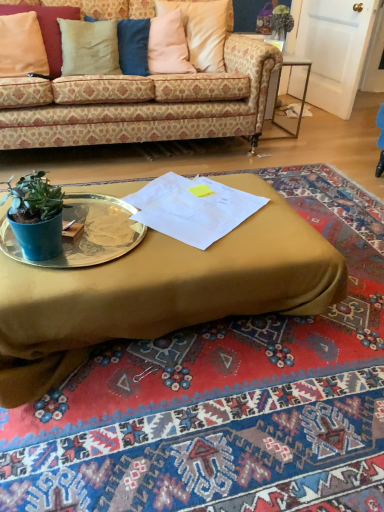
Question: Does beige fabric pillow at upper left, which is the second pillow from right to left, appear on the left side of metallic silver platter at center?

Choices:
 (A) no
 (B) yes

Answer: (B)

Question: Does beige fabric pillow at upper left, acting as the second pillow starting from the left, have a larger size compared to metallic silver platter at center?

Choices:
 (A) yes
 (B) no

Answer: (A)

Question: Could you tell me if beige fabric pillow at upper left, acting as the second pillow starting from the left, is facing metallic silver platter at center?

Choices:
 (A) yes
 (B) no

Answer: (A)

Question: Considering the relative sizes of beige fabric pillow at upper left, acting as the second pillow starting from the left, and metallic silver platter at center in the image provided, is beige fabric pillow at upper left, acting as the second pillow starting from the left, taller than metallic silver platter at center?

Choices:
 (A) yes
 (B) no

Answer: (A)

Question: Considering the relative sizes of beige fabric pillow at upper left, acting as the second pillow starting from the left, and metallic silver platter at center in the image provided, is beige fabric pillow at upper left, acting as the second pillow starting from the left, thinner than metallic silver platter at center?

Choices:
 (A) no
 (B) yes

Answer: (B)

Question: Is beige fabric pillow at upper left, acting as the second pillow starting from the left, not near metallic silver platter at center?

Choices:
 (A) no
 (B) yes

Answer: (B)

Question: Is beige fabric pillow at upper left, acting as the second pillow starting from the left, oriented away from pink fabric pillow at upper center, which is the 3th pillow from left to right?

Choices:
 (A) no
 (B) yes

Answer: (A)

Question: Is beige fabric pillow at upper left, acting as the second pillow starting from the left, far from pink fabric pillow at upper center, positioned as the first pillow in right-to-left order?

Choices:
 (A) no
 (B) yes

Answer: (A)

Question: Is pink fabric pillow at upper center, which is the 3th pillow from left to right, located within beige fabric pillow at upper left, which is the second pillow from right to left?

Choices:
 (A) no
 (B) yes

Answer: (A)

Question: From a real-world perspective, is beige fabric pillow at upper left, acting as the second pillow starting from the left, under pink fabric pillow at upper center, which is the 3th pillow from left to right?

Choices:
 (A) yes
 (B) no

Answer: (A)

Question: Does beige fabric pillow at upper left, acting as the second pillow starting from the left, have a smaller size compared to pink fabric pillow at upper center, which is the 3th pillow from left to right?

Choices:
 (A) yes
 (B) no

Answer: (A)

Question: Can you confirm if beige fabric pillow at upper left, which is the second pillow from right to left, is positioned to the left of pink fabric pillow at upper center, which is the 3th pillow from left to right?

Choices:
 (A) yes
 (B) no

Answer: (A)

Question: Considering the relative sizes of metallic silver platter at center and patterned fabric couch at upper center in the image provided, is metallic silver platter at center taller than patterned fabric couch at upper center?

Choices:
 (A) no
 (B) yes

Answer: (A)